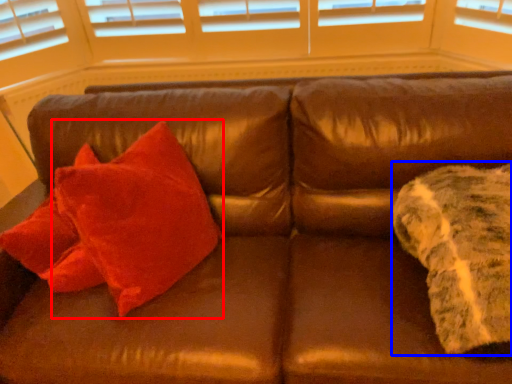
Question: Among these objects, which one is nearest to the camera, throw pillow (highlighted by a red box) or blanket (highlighted by a blue box)?

Choices:
 (A) throw pillow
 (B) blanket

Answer: (B)